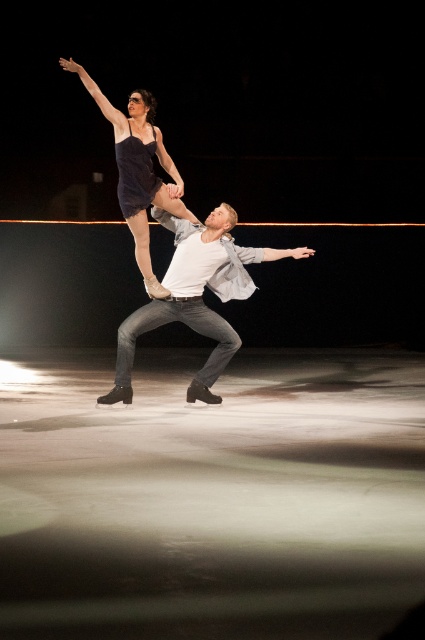
Question: Is white matte shirt at center behind matte black leotard at upper center?

Choices:
 (A) no
 (B) yes

Answer: (B)

Question: Which point is farther from the camera taking this photo?

Choices:
 (A) tap(118, 376)
 (B) tap(135, 227)

Answer: (B)

Question: Among these objects, which one is farthest from the camera?

Choices:
 (A) white matte shirt at center
 (B) matte black leotard at upper center

Answer: (A)

Question: Can you confirm if white matte shirt at center is positioned to the right of matte black leotard at upper center?

Choices:
 (A) yes
 (B) no

Answer: (A)

Question: Can you confirm if white matte shirt at center is wider than matte black leotard at upper center?

Choices:
 (A) no
 (B) yes

Answer: (B)